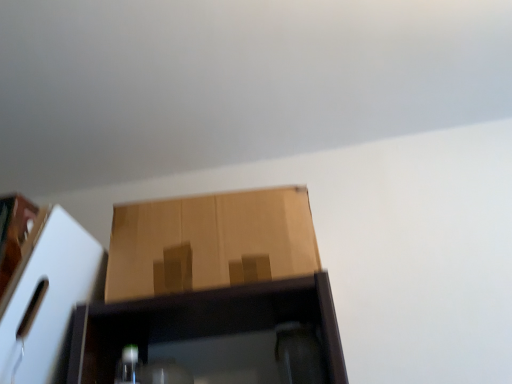
Question: Is point (123, 268) closer or farther from the camera than point (50, 309)?

Choices:
 (A) farther
 (B) closer

Answer: (A)

Question: From the image's perspective, relative to matte brown cardboard box at left, the 2th cardboard box viewed from the right, is brown cardboard box at center, which appears as the second cardboard box when viewed from the left, above or below?

Choices:
 (A) below
 (B) above

Answer: (B)

Question: Is brown cardboard box at center, which appears as the second cardboard box when viewed from the left, in front of or behind matte brown cardboard box at left, arranged as the first cardboard box when viewed from the left, in the image?

Choices:
 (A) front
 (B) behind

Answer: (B)

Question: Would you say matte brown cardboard box at left, the 2th cardboard box viewed from the right, is inside or outside brown cardboard box at center, positioned as the 1th cardboard box in right-to-left order?

Choices:
 (A) outside
 (B) inside

Answer: (A)

Question: From a real-world perspective, is matte brown cardboard box at left, arranged as the first cardboard box when viewed from the left, physically located above or below brown cardboard box at center, which appears as the second cardboard box when viewed from the left?

Choices:
 (A) above
 (B) below

Answer: (B)

Question: In the image, is matte brown cardboard box at left, arranged as the first cardboard box when viewed from the left, positioned in front of or behind brown cardboard box at center, positioned as the 1th cardboard box in right-to-left order?

Choices:
 (A) behind
 (B) front

Answer: (B)

Question: Looking at their shapes, would you say matte brown cardboard box at left, the 2th cardboard box viewed from the right, is wider or thinner than brown cardboard box at center, which appears as the second cardboard box when viewed from the left?

Choices:
 (A) wide
 (B) thin

Answer: (A)